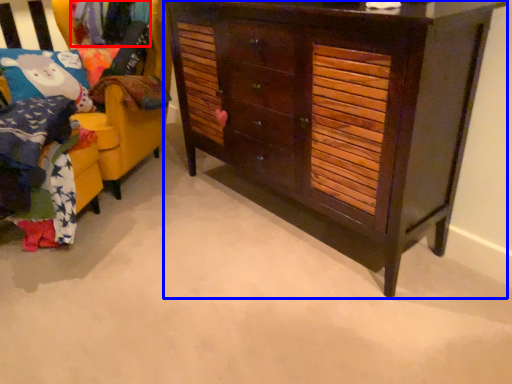
Question: Which object is closer to the camera taking this photo, clothing (highlighted by a red box) or chest of drawers (highlighted by a blue box)?

Choices:
 (A) clothing
 (B) chest of drawers

Answer: (B)